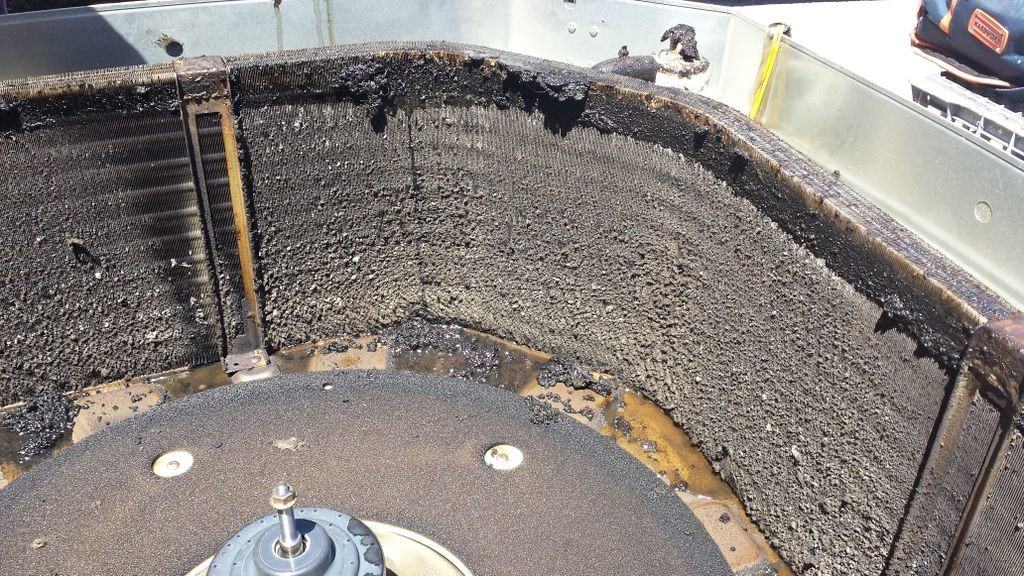
This screenshot has height=576, width=1024. I want to click on inside wall, so click(x=793, y=360), click(x=521, y=237), click(x=311, y=219), click(x=49, y=259), click(x=7, y=509).